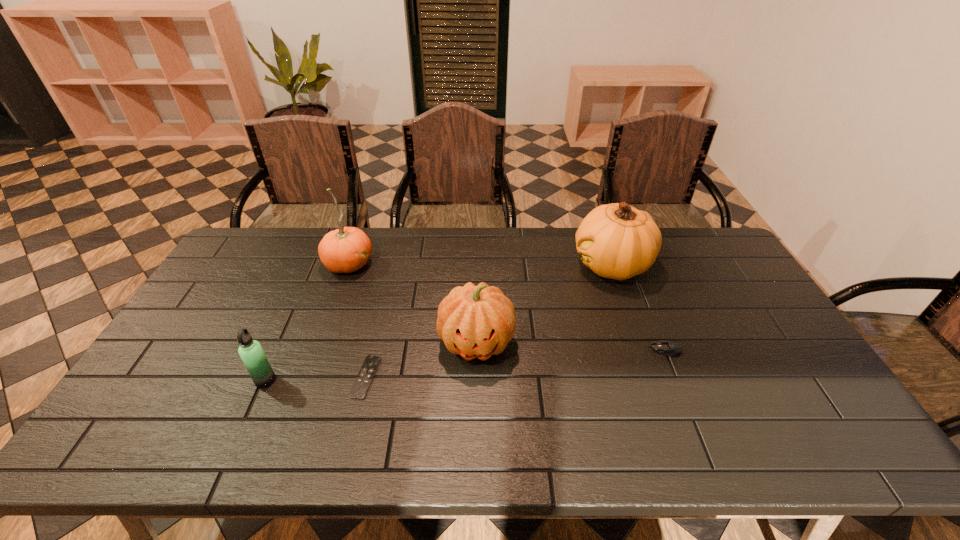
Locate an element on the screen. Image resolution: width=960 pixels, height=540 pixels. free area in between the second pumpkin from left to right and the computer mouse is located at coordinates (570, 346).

Identify the location of free spot between the leftmost pumpkin and the shortest object. The width and height of the screenshot is (960, 540). (x=357, y=321).

Locate an element on the screen. The image size is (960, 540). vacant area that lies between the shortest object and the second pumpkin from left to right is located at coordinates (421, 360).

Where is `vacant space in between the shortest object and the leftmost pumpkin`? This screenshot has height=540, width=960. vacant space in between the shortest object and the leftmost pumpkin is located at coordinates (357, 321).

You are a GUI agent. You are given a task and a screenshot of the screen. Output one action in this format:
    pyautogui.click(x=<x>, y=<y>)
    Task: Click on the free space between the fourth tallest object and the leftmost pumpkin
    This screenshot has height=540, width=960.
    Given the screenshot: What is the action you would take?
    pyautogui.click(x=307, y=322)

Locate an element on the screen. free space between the rightmost pumpkin and the third object from right to left is located at coordinates (544, 304).

Identify the location of vacant space that's between the fourth tallest object and the third object from left to right. The width and height of the screenshot is (960, 540). (316, 379).

I want to click on free area in between the leftmost pumpkin and the second pumpkin from right to left, so click(x=413, y=303).

You are a GUI agent. You are given a task and a screenshot of the screen. Output one action in this format:
    pyautogui.click(x=<x>, y=<y>)
    Task: Click on the empty space that is in between the leftmost pumpkin and the rightmost pumpkin
    This screenshot has width=960, height=540.
    Given the screenshot: What is the action you would take?
    pyautogui.click(x=480, y=265)

Locate which object ranks third in proximity to the third object from right to left. Please provide its 2D coordinates. Your answer should be formatted as a tuple, i.e. [(x, y)], where the tuple contains the x and y coordinates of a point satisfying the conditions above.

[(347, 249)]